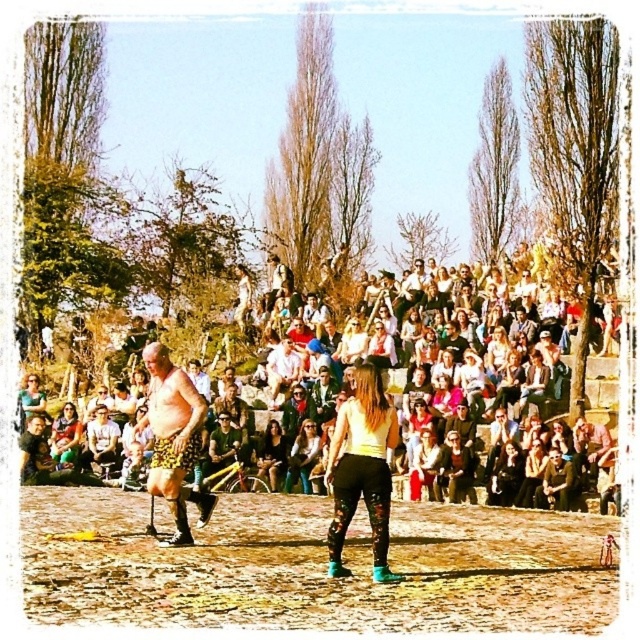
You are a photographer trying to capture a photo of the brown dirt field at center and the matte black leggings at center. From the audience perspective, which object should you focus on first if you want to include both in your frame?

The brown dirt field at center is positioned on the left side of matte black leggings at center, so you should focus on the brown dirt field at center first to include both in your frame.

You are planning to set up a small tent in the center of the image. The tent requires a space wider than the matte black leggings at center. Can you determine if the brown dirt field at center has enough width to accommodate the tent?

The brown dirt field at center is wider than the matte black leggings at center, so yes, the brown dirt field at center has enough width to accommodate the tent.

You are a photographer positioned at the front of the audience. You want to capture a photo that includes both the matte black leggings at center and the matte green dress at center. Which performer should you focus on first to ensure both are in sharp focus?

You should focus on the matte black leggings at center first since it is closer to the viewer than the matte green dress at center. By focusing on the closer object, the depth of field may still capture the matte green dress at center in acceptable focus.